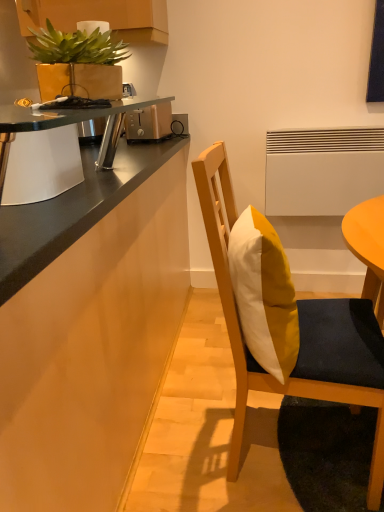
Where is `vacant space in wooden chair with cushion at center (from a real-world perspective)`? This screenshot has width=384, height=512. vacant space in wooden chair with cushion at center (from a real-world perspective) is located at coordinates (273, 446).